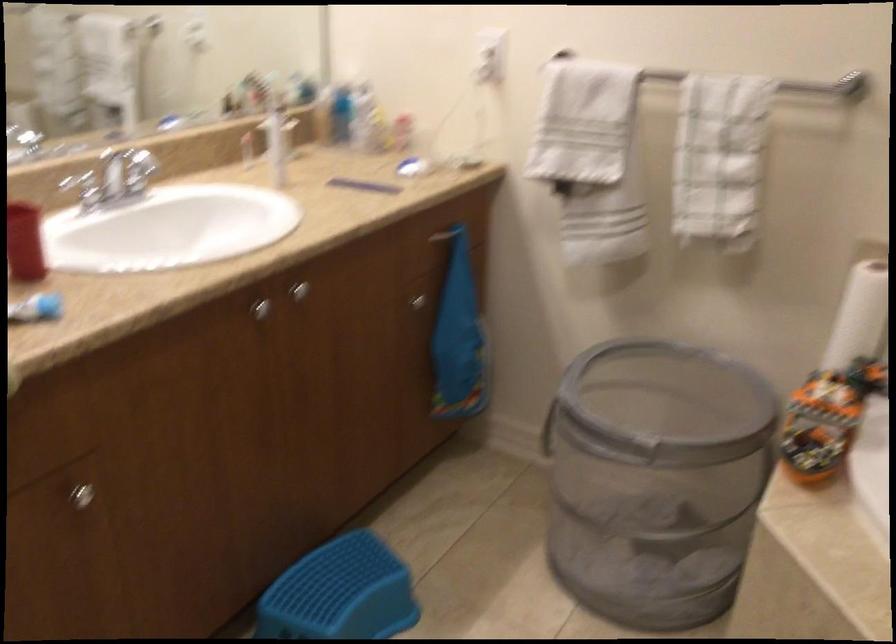
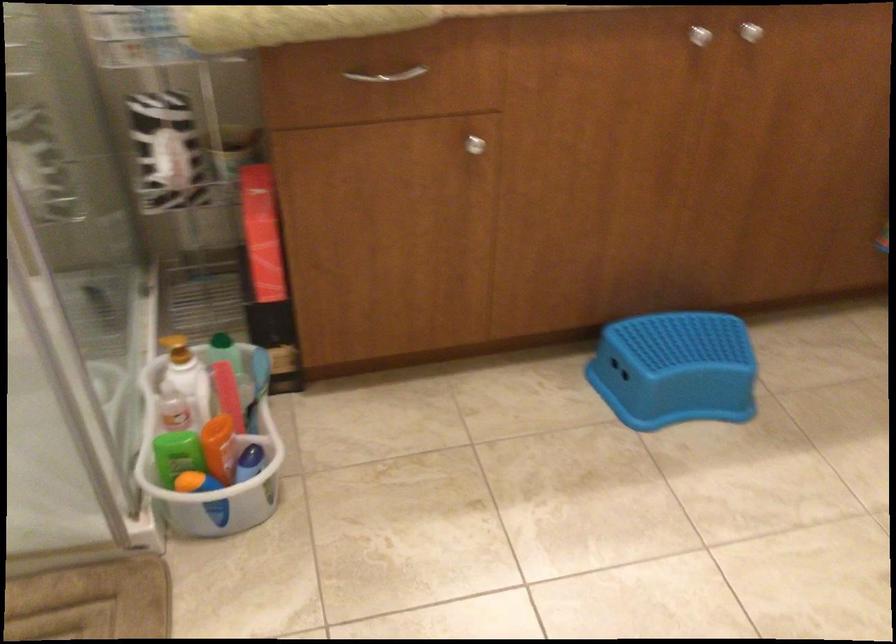
Find the pixel in the second image that matches point (254, 307) in the first image.

(700, 35)